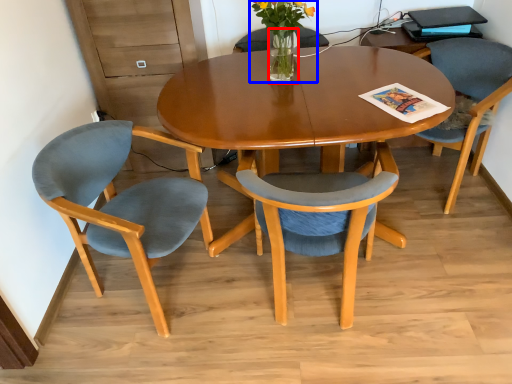
Question: Among these objects, which one is nearest to the camera, vase (highlighted by a red box) or floral arrangement (highlighted by a blue box)?

Choices:
 (A) vase
 (B) floral arrangement

Answer: (B)